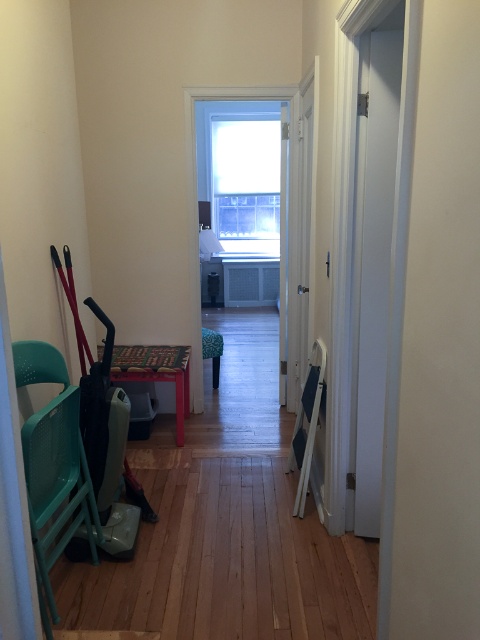
Which is below, wooden table at center or green fabric stool at center?

wooden table at center is lower down.

Does wooden table at center appear over green fabric stool at center?

No, wooden table at center is not above green fabric stool at center.

What are the coordinates of `wooden table at center` in the screenshot? It's located at (156, 372).

Is teal plastic chair at left positioned at the back of wooden table at center?

That is False.

Can you confirm if teal plastic chair at left is shorter than wooden table at center?

In fact, teal plastic chair at left may be taller than wooden table at center.

Is point (66, 518) farther from viewer compared to point (178, 372)?

No, (66, 518) is closer to viewer.

In order to click on teal plastic chair at left in this screenshot , I will do `click(54, 467)`.

Who is shorter, teal plastic chair at left or green fabric stool at center?

With less height is green fabric stool at center.

Does point (31, 500) come behind point (212, 346)?

No, it is in front of (212, 346).

Which is in front, point (57, 531) or point (210, 342)?

Point (57, 531)

Where is `teal plastic chair at left`? The height and width of the screenshot is (640, 480). teal plastic chair at left is located at coordinates (54, 467).